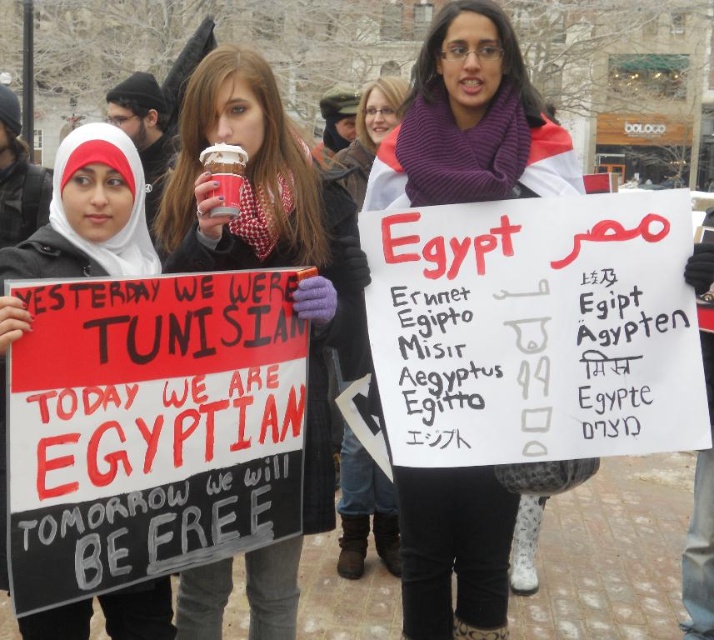
Is matte red cup at center taller than purple scarf at center?

No.

Is matte red cup at center thinner than purple scarf at center?

No.

Is point (241, 237) more distant than point (357, 481)?

No, (241, 237) is in front of (357, 481).

The width and height of the screenshot is (714, 640). Find the location of `matte red cup at center`. matte red cup at center is located at coordinates (261, 227).

Is purple knitted scarf at center taller than matte red cup at center?

Indeed, purple knitted scarf at center has a greater height compared to matte red cup at center.

Can you confirm if purple knitted scarf at center is positioned to the left of matte red cup at center?

No, purple knitted scarf at center is not to the left of matte red cup at center.

Image resolution: width=714 pixels, height=640 pixels. In order to click on purple knitted scarf at center in this screenshot , I will do `click(471, 122)`.

Is point (511, 60) positioned in front of point (356, 541)?

Yes, it is.

Is purple knitted scarf at center to the left of purple scarf at center from the viewer's perspective?

Incorrect, purple knitted scarf at center is not on the left side of purple scarf at center.

Does point (436, 522) lie behind point (358, 472)?

No, it is not.

Locate an element on the screen. purple knitted scarf at center is located at coordinates (471, 122).